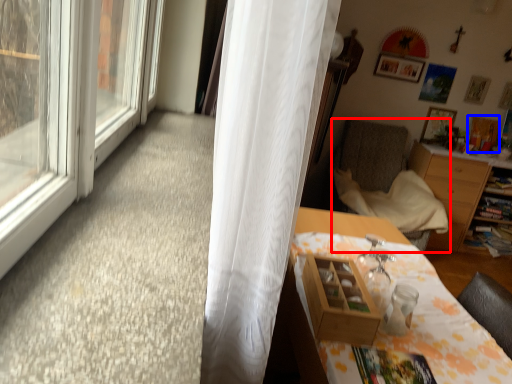
Question: Which point is further to the camera, chair (highlighted by a red box) or picture frame (highlighted by a blue box)?

Choices:
 (A) chair
 (B) picture frame

Answer: (B)